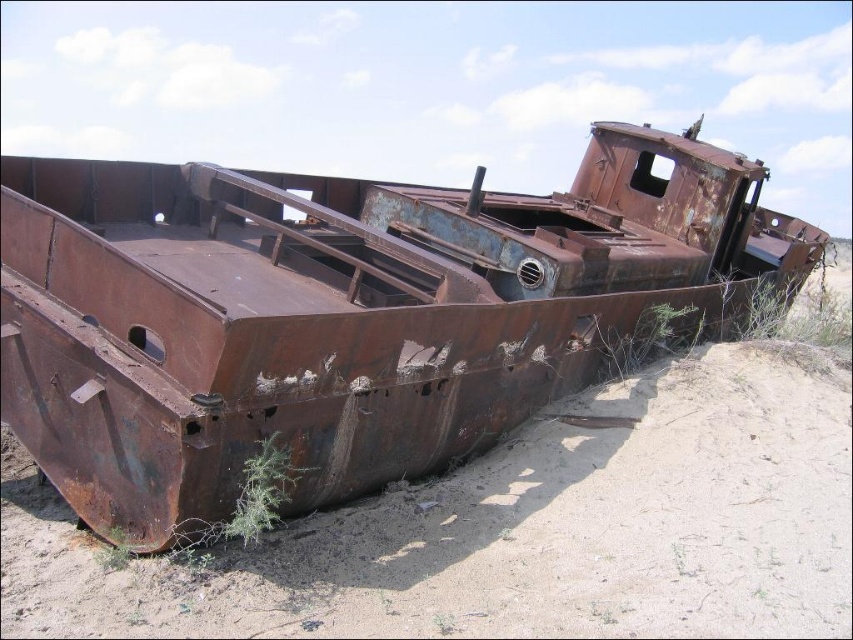
Question: In this image, where is rusty metal boat at center located relative to green fuzzy plant at lower center?

Choices:
 (A) left
 (B) right

Answer: (B)

Question: Which of the following is the farthest from the observer?

Choices:
 (A) tap(779, 278)
 (B) tap(238, 497)
 (C) tap(619, 348)
 (D) tap(581, 218)

Answer: (A)

Question: In this image, where is green fuzzy plant at lower center located relative to green leafy plant at lower right?

Choices:
 (A) above
 (B) below

Answer: (B)

Question: Which point is closer to the camera?

Choices:
 (A) rusty metal boat at center
 (B) green fuzzy plant at lower center
 (C) green leafy plant at lower center

Answer: (B)

Question: Based on their relative distances, which object is nearer to the green leafy plant at lower right?

Choices:
 (A) rusty metal boat at center
 (B) green fuzzy plant at lower center
 (C) green leafy plant at lower center

Answer: (C)

Question: Does green leafy plant at lower center appear under green leafy plant at lower right?

Choices:
 (A) no
 (B) yes

Answer: (B)